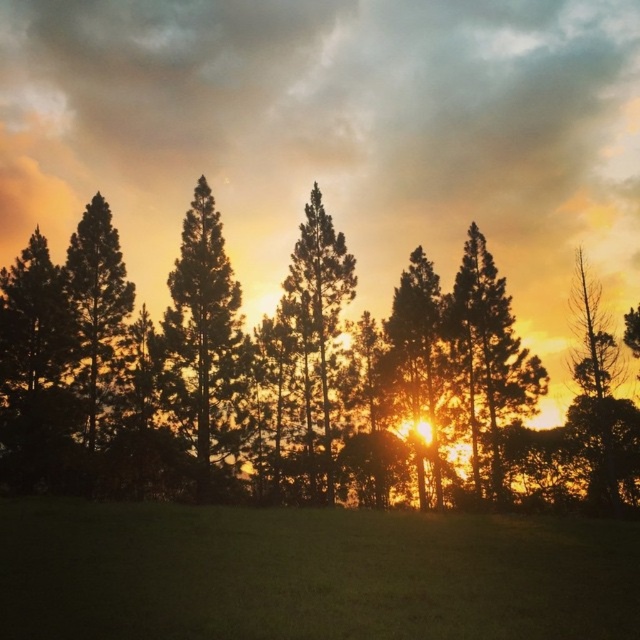
You are an artist trying to paint the sunset scene. You need to decide where to place the silhouette trees at center relative to the silhouette pine tree at left. Based on the image, which one is lower in the frame?

The silhouette trees at center is positioned under the silhouette pine tree at left, so it is lower in the frame.

You are standing in the sunset scene and want to place a small birdhouse exactly at point (292,380). According to the scene description, where will the birdhouse be placed?

The point (292,380) is on the silhouette trees at center, so the birdhouse will be placed on the silhouette trees at center.